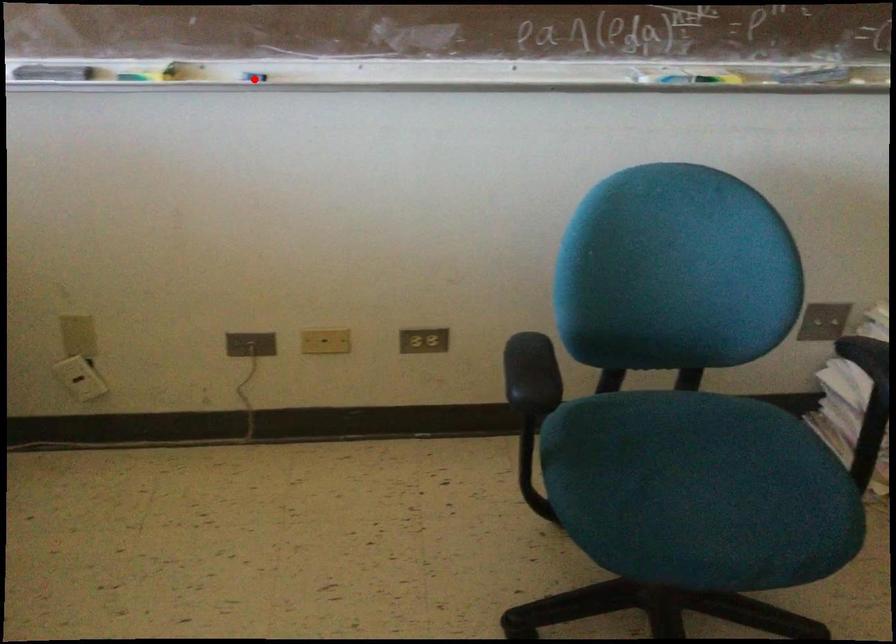
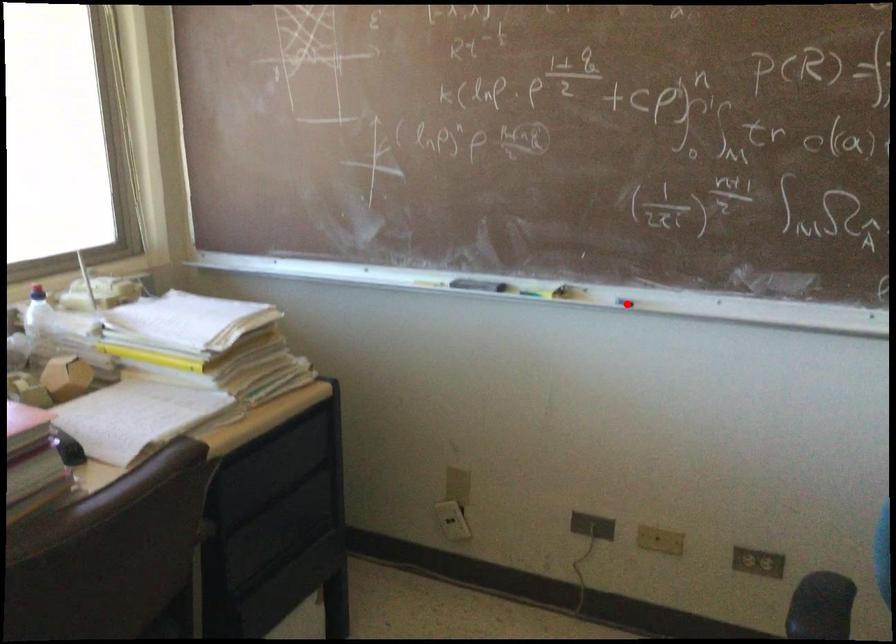
I am providing you with two images of the same scene from different viewpoints. A red point is marked on the first image and another point is marked on the second image. Do the highlighted points in image1 and image2 indicate the same real-world spot?

Yes